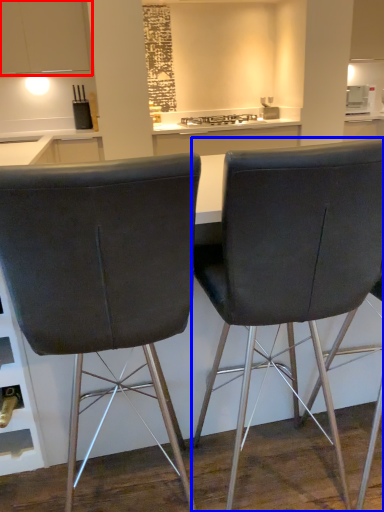
Question: Which object appears farthest to the camera in this image, cabinetry (highlighted by a red box) or chair (highlighted by a blue box)?

Choices:
 (A) cabinetry
 (B) chair

Answer: (A)